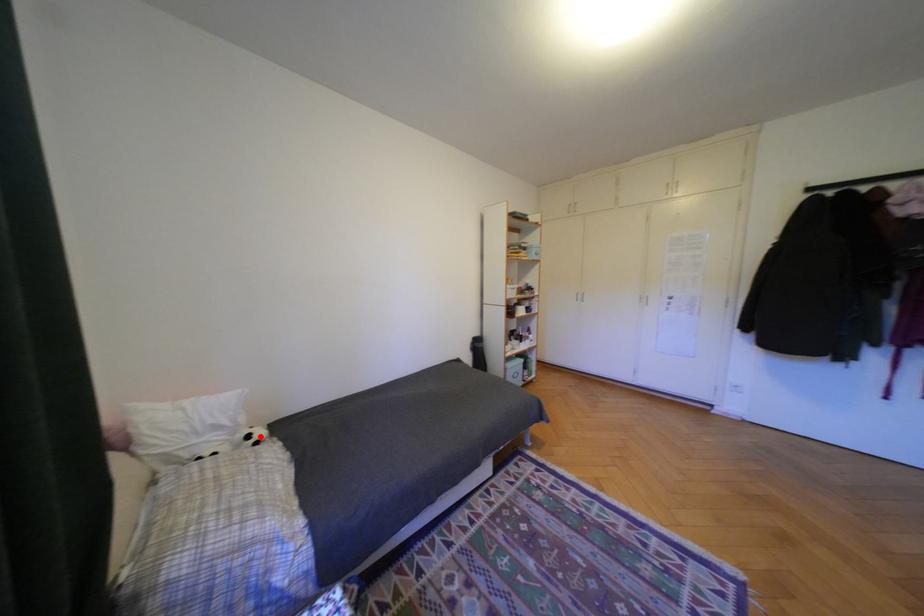
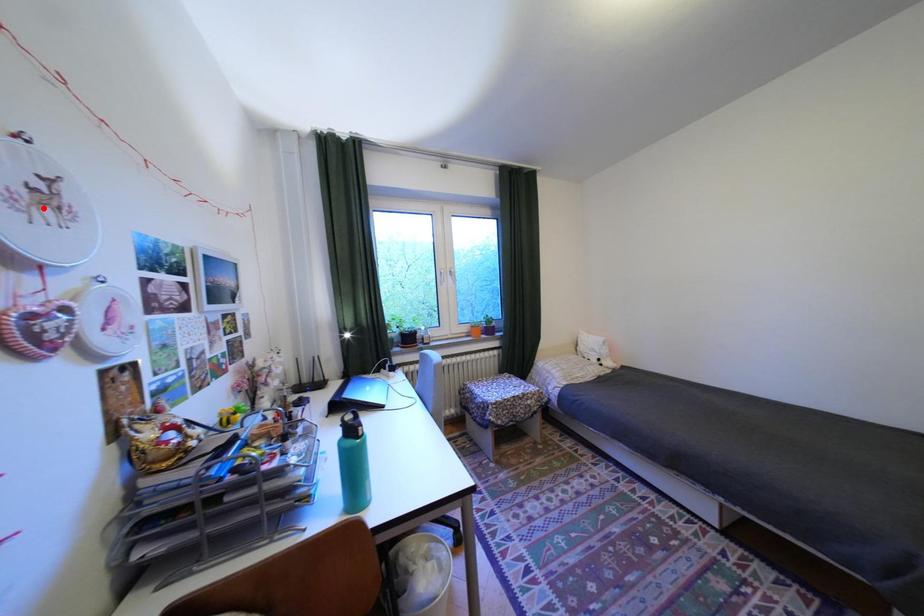
I am providing you with two images of the same scene from different viewpoints. A red point is marked on the first image and another point is marked on the second image. Do the highlighted points in image1 and image2 indicate the same real-world spot?

No